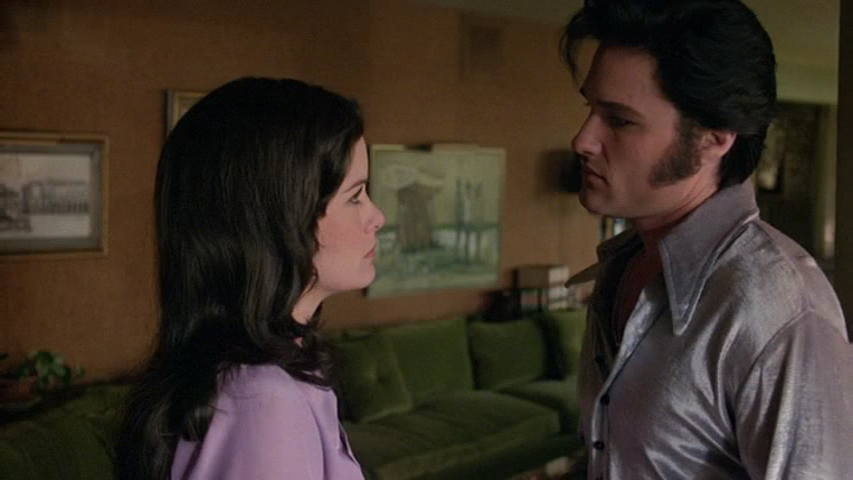
The width and height of the screenshot is (853, 480). Find the location of `art work`. art work is located at coordinates (26, 192), (178, 106), (459, 179).